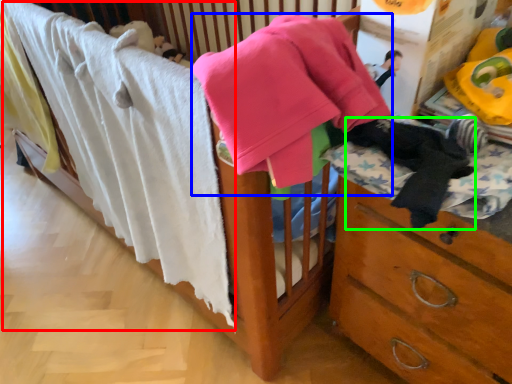
Question: Considering the real-world distances, which object is farthest from bath towel (highlighted by a red box)? baby clothe (highlighted by a blue box) or clothing (highlighted by a green box)?

Choices:
 (A) baby clothe
 (B) clothing

Answer: (B)